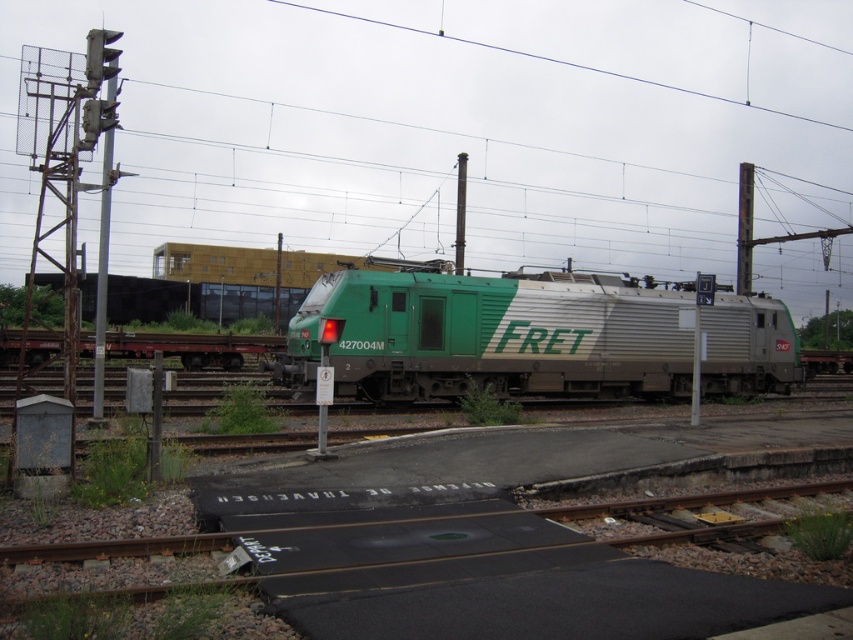
Question: Can you confirm if metallic wire at upper center is positioned below green metallic pole at center?

Choices:
 (A) yes
 (B) no

Answer: (B)

Question: Does metallic wire at upper center come in front of smooth metallic pole at center?

Choices:
 (A) no
 (B) yes

Answer: (A)

Question: Is metallic signal light at left further to the viewer compared to smooth metallic pole at center?

Choices:
 (A) no
 (B) yes

Answer: (A)

Question: Which of the following is the farthest from the observer?

Choices:
 (A) (743, 250)
 (B) (102, 291)
 (C) (614, 72)
 (D) (509, 348)

Answer: (C)

Question: Which object appears farthest from the camera in this image?

Choices:
 (A) metallic wire at upper center
 (B) metallic gray pole at upper right

Answer: (A)

Question: Based on their relative distances, which object is nearer to the metallic signal light at left?

Choices:
 (A) metallic wire at upper center
 (B) smooth metallic pole at center
 (C) green metallic freight locomotive at center

Answer: (C)